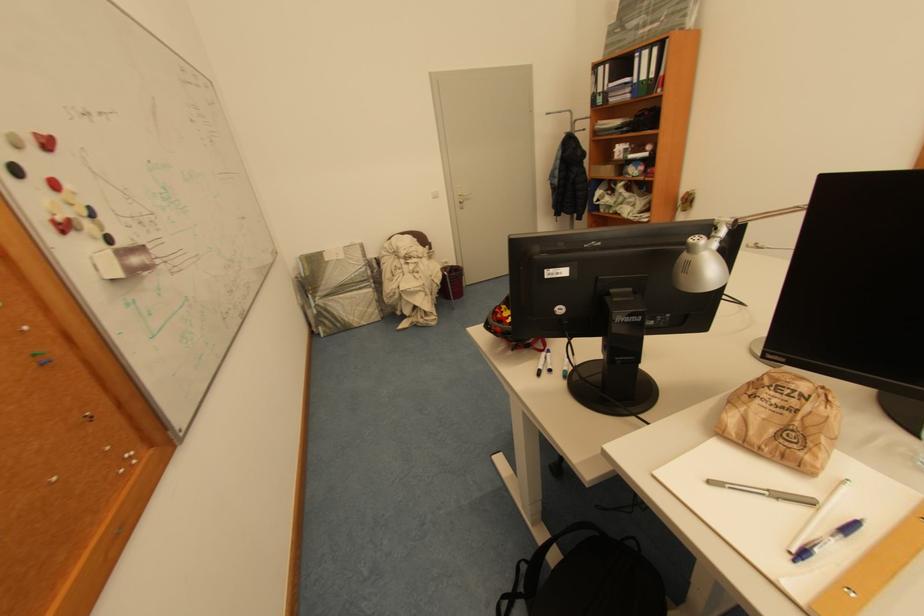
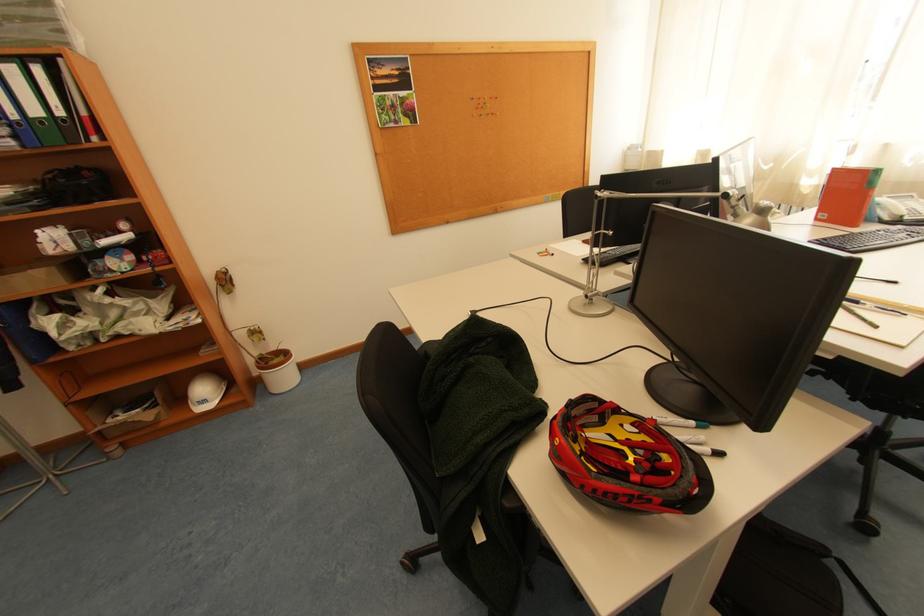
Locate, in the second image, the point that corresponds to the point at 638,94 in the first image.

(23, 139)